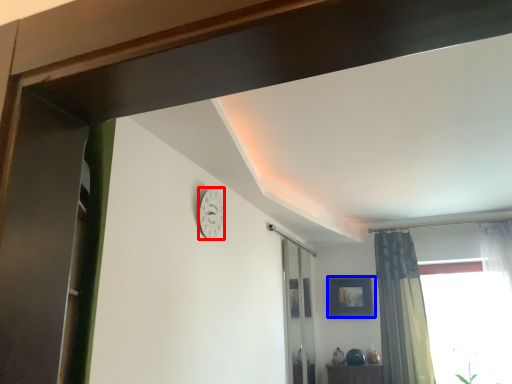
Question: Among these objects, which one is nearest to the camera, clock (highlighted by a red box) or picture frame (highlighted by a blue box)?

Choices:
 (A) clock
 (B) picture frame

Answer: (A)